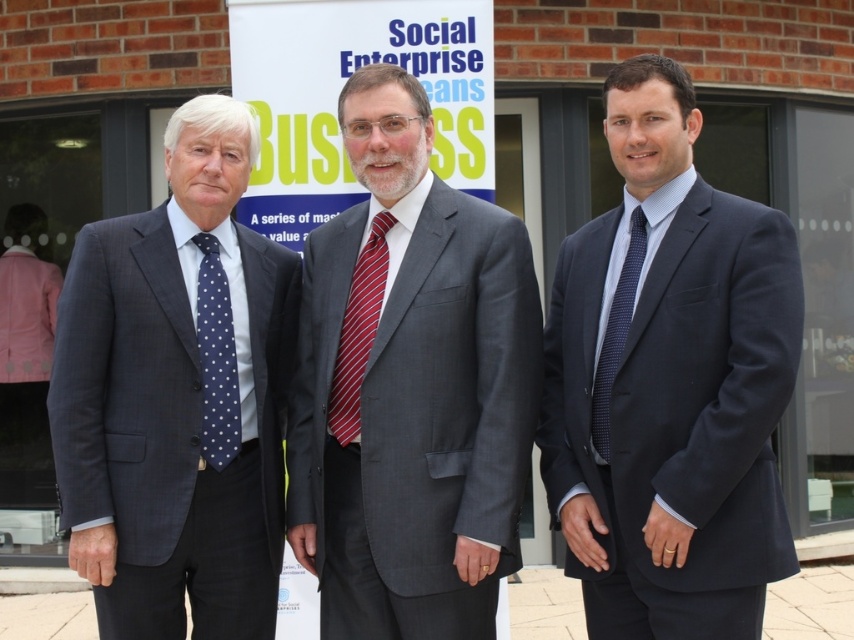
At what (x,y) coordinates should I click in order to perform the action: click on matte blue suit at right. Please return your answer as a coordinate pair (x, y). The width and height of the screenshot is (854, 640). Looking at the image, I should click on (670, 381).

Does matte blue suit at right appear under matte blue suit at left?

Incorrect, matte blue suit at right is not positioned below matte blue suit at left.

Who is more forward, (594, 468) or (244, 148)?

Point (594, 468) is more forward.

Locate an element on the screen. This screenshot has height=640, width=854. matte blue suit at right is located at coordinates (670, 381).

Does gray suit at center have a greater width compared to navy dotted tie at left?

Yes.

Between point (481, 611) and point (219, 438), which one is positioned behind?

Point (219, 438)

In the scene shown: Measure the distance between point (466, 330) and camera.

Point (466, 330) and camera are 3.33 meters apart.

Locate an element on the screen. This screenshot has height=640, width=854. gray suit at center is located at coordinates (410, 387).

Is matte blue suit at right positioned in front of dark blue dotted tie at center?

Yes, it is.

Is matte blue suit at right taller than dark blue dotted tie at center?

Indeed, matte blue suit at right has a greater height compared to dark blue dotted tie at center.

Which is in front, point (770, 465) or point (607, 384)?

Point (770, 465) is more forward.

Locate an element on the screen. The height and width of the screenshot is (640, 854). matte blue suit at right is located at coordinates (670, 381).